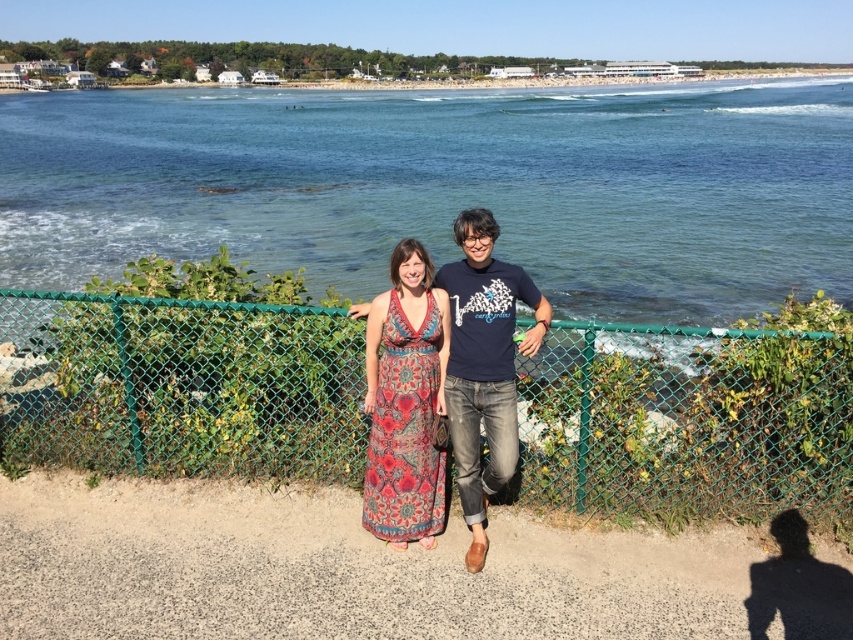
Question: Does patterned fabric dress at center come in front of printed fabric dress at center?

Choices:
 (A) no
 (B) yes

Answer: (B)

Question: Which object appears farthest from the camera in this image?

Choices:
 (A) printed fabric dress at center
 (B) green chain-link fence at center
 (C) smooth sand at lower center

Answer: (B)

Question: Which point is closer to the camera?

Choices:
 (A) click(x=450, y=330)
 (B) click(x=309, y=380)

Answer: (A)

Question: Does green chain-link fence at center lie in front of printed fabric dress at center?

Choices:
 (A) yes
 (B) no

Answer: (B)

Question: Is smooth sand at lower center smaller than printed fabric dress at center?

Choices:
 (A) yes
 (B) no

Answer: (B)

Question: Which of the following is the closest to the observer?

Choices:
 (A) (79, 476)
 (B) (467, 332)

Answer: (B)